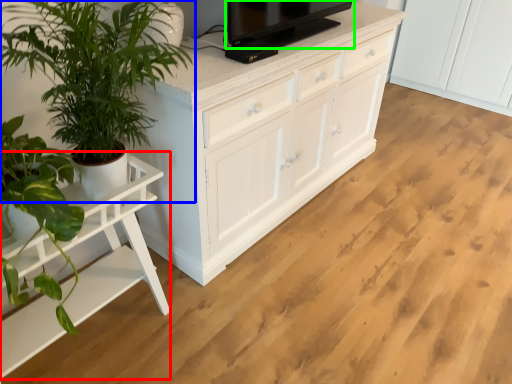
Question: Based on their relative distances, which object is nearer to table (highlighted by a red box)? Choose from houseplant (highlighted by a blue box) and television (highlighted by a green box).

Choices:
 (A) houseplant
 (B) television

Answer: (A)